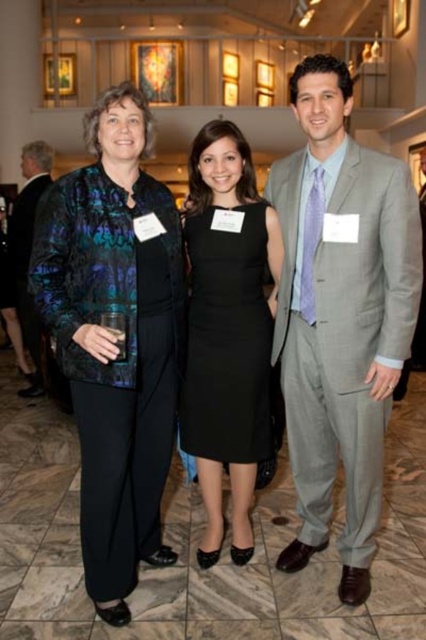
Is black satin dress at center smaller than matte black suit at left?

Yes, black satin dress at center is smaller than matte black suit at left.

Does black satin dress at center have a lesser width compared to matte black suit at left?

Yes, black satin dress at center is thinner than matte black suit at left.

At what (x,y) coordinates should I click in order to perform the action: click on black satin dress at center. Please return your answer as a coordinate pair (x, y). This screenshot has width=426, height=640. Looking at the image, I should click on (227, 339).

Who is taller, gray suit at center or black satin dress at center?

With more height is gray suit at center.

Between gray suit at center and black satin dress at center, which one is positioned lower?

black satin dress at center is lower down.

In order to click on gray suit at center in this screenshot , I will do `click(340, 314)`.

At what (x,y) coordinates should I click in order to perform the action: click on gray suit at center. Please return your answer as a coordinate pair (x, y). Looking at the image, I should click on (340, 314).

Which is more to the left, gray suit at center or velvet-like black pantsuit at left?

velvet-like black pantsuit at left

In the scene shown: Can you confirm if gray suit at center is wider than velvet-like black pantsuit at left?

Yes, gray suit at center is wider than velvet-like black pantsuit at left.

Locate an element on the screen. This screenshot has height=640, width=426. gray suit at center is located at coordinates (340, 314).